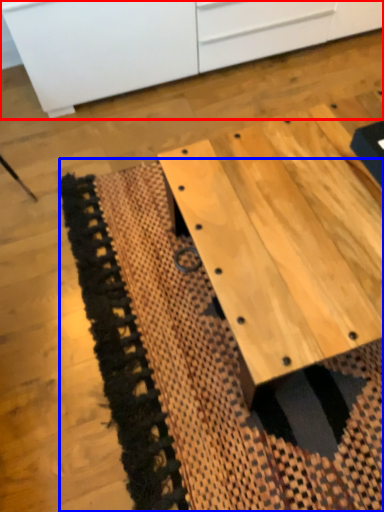
Question: Among these objects, which one is farthest to the camera, cabinetry (highlighted by a red box) or mat (highlighted by a blue box)?

Choices:
 (A) cabinetry
 (B) mat

Answer: (A)